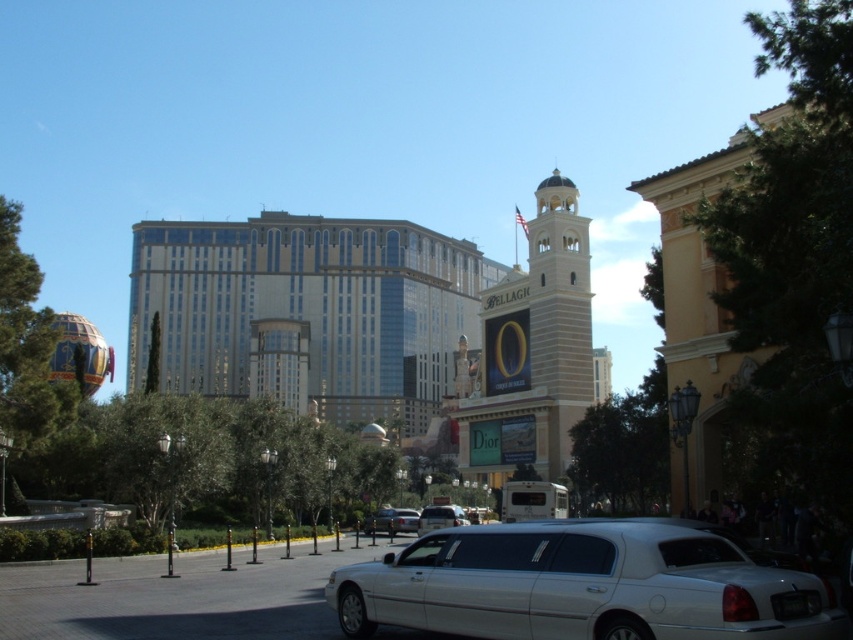
Question: Which object appears farthest from the camera in this image?

Choices:
 (A) white metallic car at center
 (B) glassy metallic building at center
 (C) beige stone clock tower at center
 (D) silver metallic car at center

Answer: (B)

Question: Can you confirm if beige stone clock tower at center is positioned above white metallic car at center?

Choices:
 (A) yes
 (B) no

Answer: (A)

Question: Can you confirm if white glossy limousine at lower center is positioned below silver metallic car at center?

Choices:
 (A) yes
 (B) no

Answer: (B)

Question: Among these points, which one is farthest from the camera?

Choices:
 (A) tap(553, 307)
 (B) tap(337, 385)

Answer: (B)

Question: Which point is farther to the camera?

Choices:
 (A) glassy metallic building at center
 (B) white glossy limousine at lower center
 (C) white metallic car at center
 (D) beige stone clock tower at center

Answer: (A)

Question: Is the position of beige stone clock tower at center less distant than that of white metallic car at center?

Choices:
 (A) yes
 (B) no

Answer: (B)